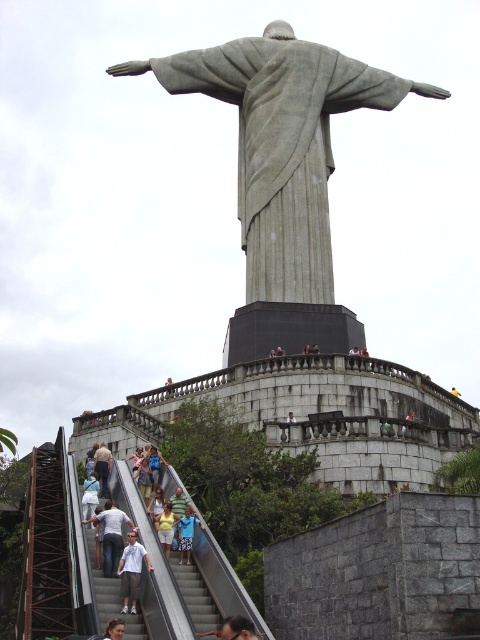
Between gray concrete stairs at lower center and light brown hair at lower center, which one appears on the right side from the viewer's perspective?

gray concrete stairs at lower center

Is point (181, 577) in front of point (109, 637)?

No.

Between point (200, 600) and point (115, 634), which one is positioned in front?

Point (115, 634) is more forward.

You are a GUI agent. You are given a task and a screenshot of the screen. Output one action in this format:
    pyautogui.click(x=<x>, y=<y>)
    Task: Click on the gray concrete stairs at lower center
    The height and width of the screenshot is (640, 480).
    Given the screenshot: What is the action you would take?
    pyautogui.click(x=194, y=595)

Does white cotton shirt at lower center appear over white fabric shirt at lower center?

Actually, white cotton shirt at lower center is below white fabric shirt at lower center.

Can you confirm if white cotton shirt at lower center is bigger than white fabric shirt at lower center?

No, white cotton shirt at lower center is not bigger than white fabric shirt at lower center.

Is point (123, 593) farther from viewer compared to point (93, 488)?

No, it is in front of (93, 488).

Find the location of a particular element. Image resolution: width=480 pixels, height=640 pixels. white cotton shirt at lower center is located at coordinates (132, 570).

Can you confirm if white cotton shirt at lower center is positioned above blue shirt at center?

No.

Does white cotton shirt at lower center have a lesser height compared to blue shirt at center?

Incorrect, white cotton shirt at lower center's height does not fall short of blue shirt at center's.

Does point (127, 604) come farther from viewer compared to point (182, 540)?

No, (127, 604) is in front of (182, 540).

Identify the location of white cotton shirt at lower center. (132, 570).